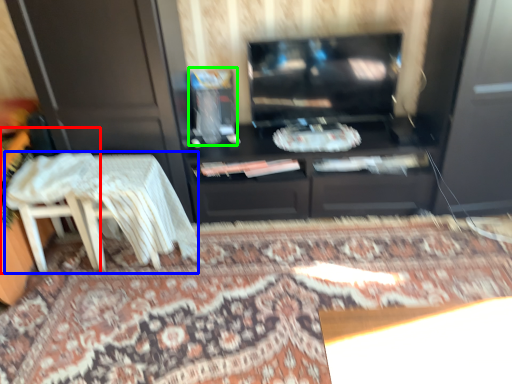
Question: Which object is positioned farthest from chair (highlighted by a red box)? Select from table (highlighted by a blue box) and appliance (highlighted by a green box).

Choices:
 (A) table
 (B) appliance

Answer: (B)